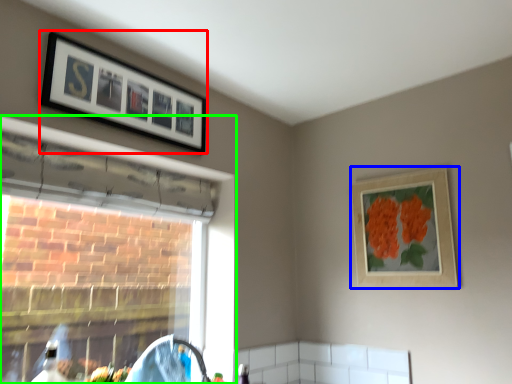
Question: Which object is positioned farthest from picture frame (highlighted by a red box)? Select from picture frame (highlighted by a blue box) and window (highlighted by a green box).

Choices:
 (A) picture frame
 (B) window

Answer: (A)